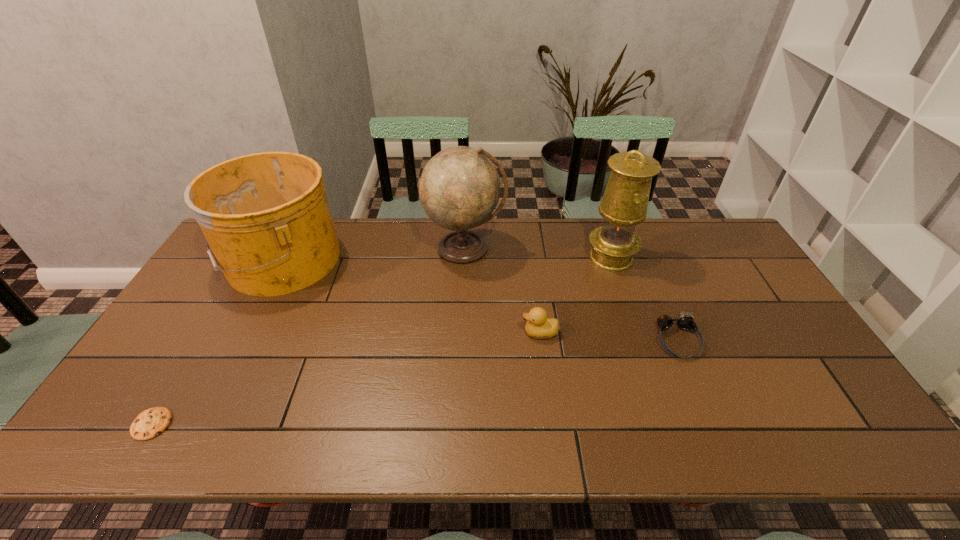
Where is `free spot between the fourth object from right to left and the third tallest object`? This screenshot has width=960, height=540. free spot between the fourth object from right to left and the third tallest object is located at coordinates (373, 254).

Where is `empty location between the fifth tallest object and the third object from left to right`? empty location between the fifth tallest object and the third object from left to right is located at coordinates 571,294.

This screenshot has width=960, height=540. What are the coordinates of `unoccupied area between the shortest object and the oil lamp` in the screenshot? It's located at (381, 341).

Where is `empty space that is in between the oil lamp and the fourth object from right to left`? empty space that is in between the oil lamp and the fourth object from right to left is located at coordinates (538, 253).

You are a GUI agent. You are given a task and a screenshot of the screen. Output one action in this format:
    pyautogui.click(x=<x>, y=<y>)
    Task: Click on the vacant area between the bucket and the duckling
    The height and width of the screenshot is (540, 960).
    Given the screenshot: What is the action you would take?
    pyautogui.click(x=411, y=296)

The height and width of the screenshot is (540, 960). I want to click on empty space that is in between the cookie and the oil lamp, so click(x=381, y=341).

Where is `empty location between the goggles and the duckling`? empty location between the goggles and the duckling is located at coordinates (609, 336).

Find the location of a particular element. This screenshot has height=540, width=960. vacant point located between the globe and the third tallest object is located at coordinates pyautogui.click(x=373, y=254).

Find the location of a particular element. This screenshot has height=540, width=960. object that is the third nearest to the third object from left to right is located at coordinates (266, 217).

Select which object appears as the third closest to the fourth shortest object. Please provide its 2D coordinates. Your answer should be formatted as a tuple, i.e. [(x, y)], where the tuple contains the x and y coordinates of a point satisfying the conditions above.

[(539, 326)]